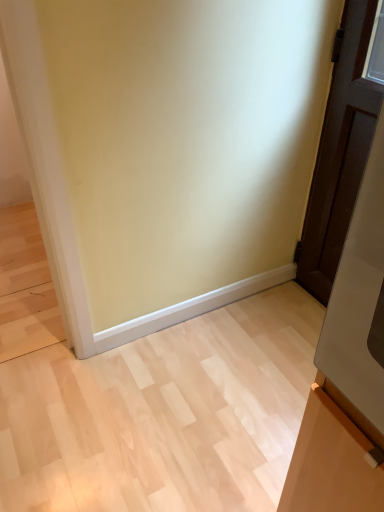
Where is `dark brown wood door at right`? The width and height of the screenshot is (384, 512). dark brown wood door at right is located at coordinates (340, 153).

What do you see at coordinates (340, 153) in the screenshot?
I see `dark brown wood door at right` at bounding box center [340, 153].

What is the approximate height of dark brown wood door at right?

dark brown wood door at right is 1.16 meters tall.

Locate an element on the screen. dark brown wood door at right is located at coordinates (340, 153).